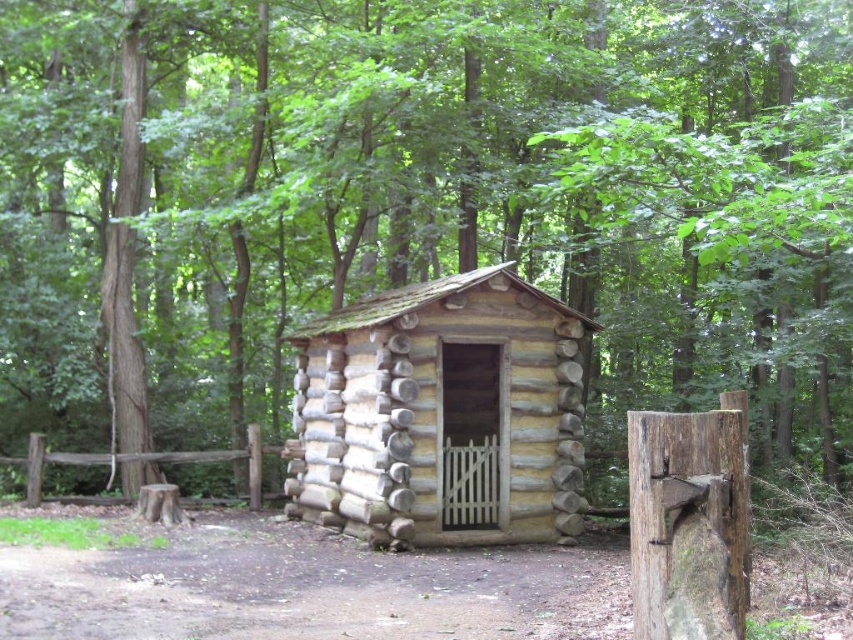
You are a carpenter who needs to choose between the smooth brown log at center and the brown wooden fence at lower left for a project requiring a thinner material. Which object should you select?

The smooth brown log at center is thinner than the brown wooden fence at lower left, so you should select the smooth brown log at center for your project.

You are standing in the forest and see the light brown wooden log cabin at center and the smooth brown log at center. Which object is positioned lower in the image?

The light brown wooden log cabin at center is located below smooth brown log at center, so it is positioned lower in the image.

You are standing in the dense forest near the light brown wooden log cabin at center. If you want to reach the cabin, which direction should you move relative to your current position?

The light brown wooden log cabin at center is located at point (442, 413), so you should move towards the center of the forest to reach it.